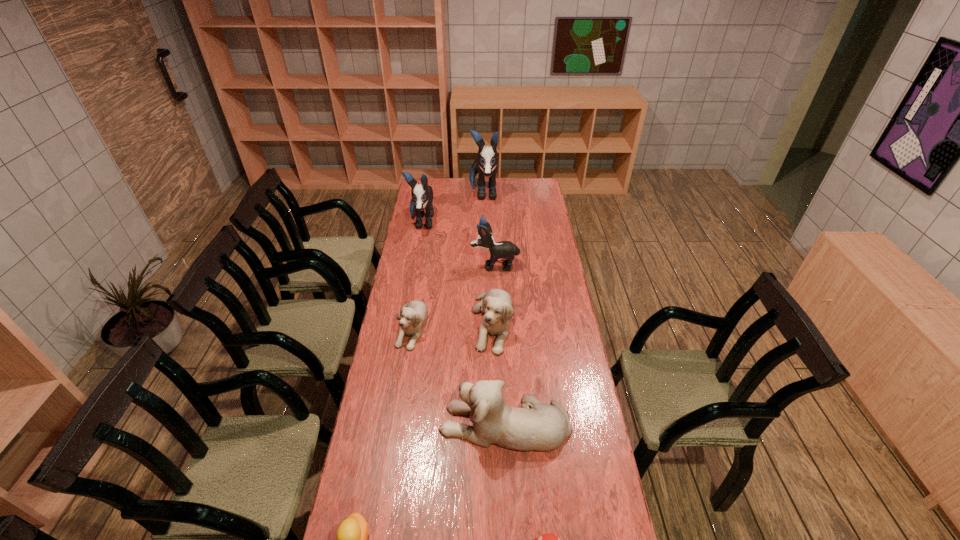
Where is `free location located 0.280m on the front-facing side of the second biggest white puppy`? The image size is (960, 540). free location located 0.280m on the front-facing side of the second biggest white puppy is located at coordinates (495, 421).

The image size is (960, 540). What are the coordinates of `free space located on the front-facing side of the smallest white puppy` in the screenshot? It's located at (394, 436).

Locate an element on the screen. Image resolution: width=960 pixels, height=540 pixels. object situated at the far edge is located at coordinates (486, 164).

You are a GUI agent. You are given a task and a screenshot of the screen. Output one action in this format:
    pyautogui.click(x=<x>, y=<y>)
    Task: Click on the object at the right edge
    The width and height of the screenshot is (960, 540).
    Given the screenshot: What is the action you would take?
    (x=543, y=427)

At what (x,y) coordinates should I click in order to perform the action: click on vacant space at the far edge of the desktop. Please return your answer as a coordinate pair (x, y). Image resolution: width=960 pixels, height=540 pixels. Looking at the image, I should click on coord(464,194).

Find the location of `blank space at the left edge of the desktop`. blank space at the left edge of the desktop is located at coordinates (427, 239).

The height and width of the screenshot is (540, 960). Identify the location of free space at the right edge of the desktop. (570, 310).

Where is `free space at the far left corner of the desktop`? This screenshot has width=960, height=540. free space at the far left corner of the desktop is located at coordinates (442, 183).

Identify the location of free space between the fifth tallest puppy and the nearest puppy. (498, 374).

This screenshot has height=540, width=960. I want to click on free area in between the shortest puppy and the fourth shortest object, so click(451, 325).